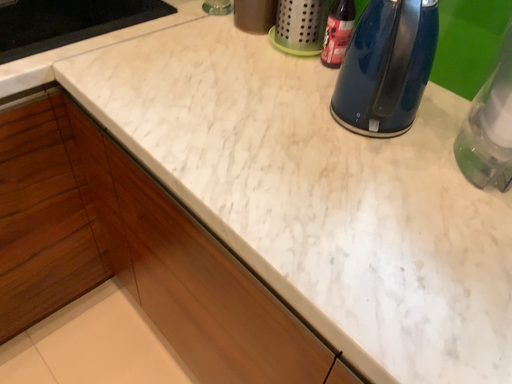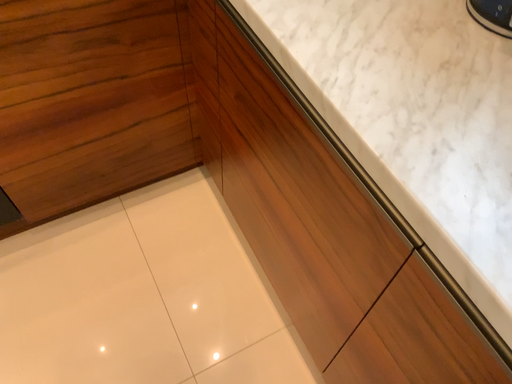
Question: How did the camera likely rotate when shooting the video?

Choices:
 (A) rotated upward
 (B) rotated downward

Answer: (B)